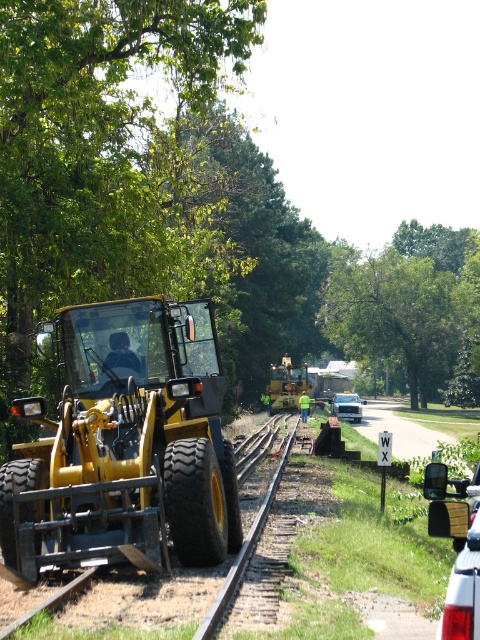
Question: Which of the following is the closest to the observer?

Choices:
 (A) (477, 378)
 (B) (195, 637)

Answer: (B)

Question: Can you confirm if green leafy tree at left is thinner than glossy plastic mirror at lower right?

Choices:
 (A) no
 (B) yes

Answer: (A)

Question: From the image, what is the correct spatial relationship of yellow rubber tractor at center in relation to yellow rubber construction worker at center?

Choices:
 (A) below
 (B) above

Answer: (A)

Question: Estimate the real-world distances between objects in this image. Which object is farther from the smooth metal train track at center?

Choices:
 (A) yellow rubber tractor at center
 (B) green leafy tree at upper left

Answer: (B)

Question: Does yellow rubber construction worker at center have a larger size compared to metallic silver sedan at center?

Choices:
 (A) yes
 (B) no

Answer: (B)

Question: Which object is closer to the camera taking this photo?

Choices:
 (A) green leafy tree at left
 (B) yellow rubber construction worker at center
 (C) metallic silver sedan at center

Answer: (B)